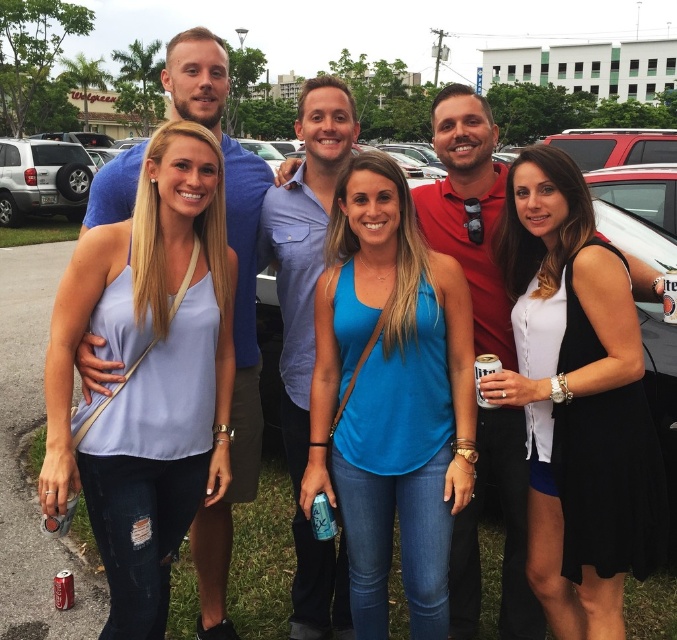
Identify the location of blue fabric tank top at center. (391, 396).

From the picture: Does blue fabric tank top at center have a lesser height compared to matte red shirt at center?

In fact, blue fabric tank top at center may be taller than matte red shirt at center.

The height and width of the screenshot is (640, 677). Describe the element at coordinates (391, 396) in the screenshot. I see `blue fabric tank top at center` at that location.

You are a GUI agent. You are given a task and a screenshot of the screen. Output one action in this format:
    pyautogui.click(x=<x>, y=<y>)
    Task: Click on the blue fabric tank top at center
    This screenshot has height=640, width=677.
    Given the screenshot: What is the action you would take?
    pyautogui.click(x=391, y=396)

Is point (609, 536) behind point (43, 193)?

No, (609, 536) is in front of (43, 193).

Does black sleeveless dress at center have a smaller size compared to silver metallic suv at left?

Yes.

This screenshot has height=640, width=677. Find the location of `black sleeveless dress at center`. black sleeveless dress at center is located at coordinates pos(575,401).

Can you confirm if black sleeveless dress at center is positioned to the right of blue shirt at center?

Correct, you'll find black sleeveless dress at center to the right of blue shirt at center.

Which is above, black sleeveless dress at center or blue shirt at center?

blue shirt at center is higher up.

Is point (542, 545) positioned after point (284, 406)?

No.

Image resolution: width=677 pixels, height=640 pixels. Find the location of `black sleeveless dress at center`. black sleeveless dress at center is located at coordinates (575, 401).